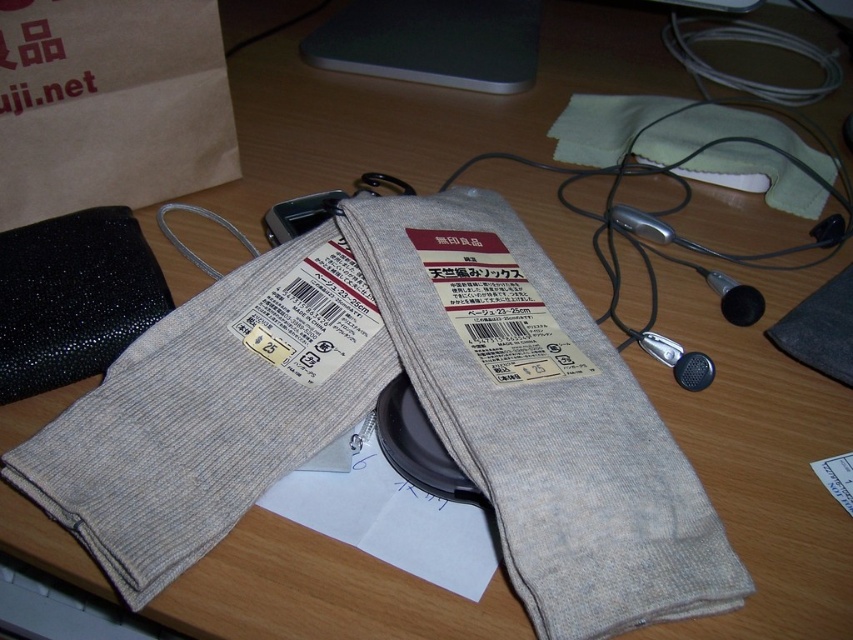
Is gray ribbed socks at center positioned behind brown paper bag at upper left?

No, it is not.

Is gray ribbed socks at center shorter than brown paper bag at upper left?

No.

Which is behind, point (293, 330) or point (67, 108)?

Point (67, 108)

Identify the location of gray ribbed socks at center. The height and width of the screenshot is (640, 853). (210, 412).

Who is lower down, gray knitted socks at center or gray ribbed socks at center?

gray ribbed socks at center

Is point (666, 557) farther from camera compared to point (64, 458)?

No, it is not.

What are the coordinates of `gray knitted socks at center` in the screenshot? It's located at (543, 419).

Can you confirm if gray knitted socks at center is wider than brown paper bag at upper left?

Yes, gray knitted socks at center is wider than brown paper bag at upper left.

Between gray knitted socks at center and brown paper bag at upper left, which one appears on the right side from the viewer's perspective?

gray knitted socks at center

The image size is (853, 640). Find the location of `gray knitted socks at center`. gray knitted socks at center is located at coordinates (543, 419).